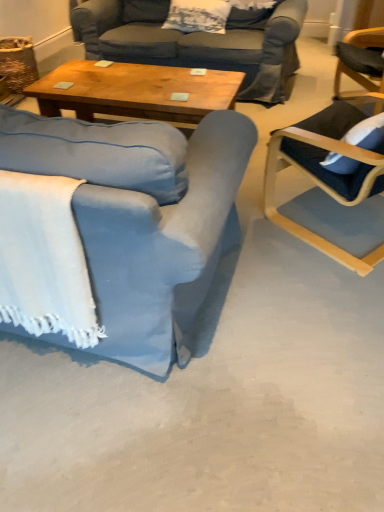
In order to face blue fabric chair at left, marked as the 1th chair in a left-to-right arrangement, should I rotate leftwards or rightwards?

You should rotate left by 18.166 degrees.

In order to face wooden coffee table at center, should I rotate leftwards or rightwards?

Rotate your view left by about 6.820°.

The image size is (384, 512). What do you see at coordinates (198, 16) in the screenshot? I see `white textured pillow at upper center` at bounding box center [198, 16].

The height and width of the screenshot is (512, 384). I want to click on white woven blanket at lower left, so click(x=44, y=260).

Could you tell me if white textured pillow at upper center is turned towards white woven blanket at lower left?

Yes, white textured pillow at upper center is aimed at white woven blanket at lower left.

Between white textured pillow at upper center and white woven blanket at lower left, which one has larger width?

With larger width is white textured pillow at upper center.

Which is less distant, [169,18] or [27,313]?

Positioned in front is point [27,313].

Looking at their sizes, would you say dark blue fabric chair at right, which ranks as the 1th chair in right-to-left order, is wider or thinner than blue fabric chair at left, marked as the 1th chair in a left-to-right arrangement?

Considering their sizes, dark blue fabric chair at right, which ranks as the 1th chair in right-to-left order, looks slimmer than blue fabric chair at left, marked as the 1th chair in a left-to-right arrangement.

Considering the relative positions of dark blue fabric chair at right, which ranks as the 1th chair in right-to-left order, and blue fabric chair at left, marked as the 1th chair in a left-to-right arrangement, in the image provided, is dark blue fabric chair at right, which ranks as the 1th chair in right-to-left order, to the left of blue fabric chair at left, marked as the 1th chair in a left-to-right arrangement, from the viewer's perspective?

Incorrect, dark blue fabric chair at right, which ranks as the 1th chair in right-to-left order, is not on the left side of blue fabric chair at left, marked as the 1th chair in a left-to-right arrangement.

From a real-world perspective, between dark blue fabric chair at right, the 2th chair when ordered from left to right, and blue fabric chair at left, which is the 2th chair from right to left, who is vertically higher?

In real-world perspective, dark blue fabric chair at right, the 2th chair when ordered from left to right, is above.

Can you confirm if dark blue fabric chair at right, the 2th chair when ordered from left to right, is bigger than blue fabric chair at left, which is the 2th chair from right to left?

No.

Consider the image. From their relative heights in the image, would you say white woven blanket at lower left is taller or shorter than dark blue fabric chair at right, which ranks as the 1th chair in right-to-left order?

In the image, white woven blanket at lower left appears to be shorter than dark blue fabric chair at right, which ranks as the 1th chair in right-to-left order.

How far apart are white woven blanket at lower left and dark blue fabric chair at right, the 2th chair when ordered from left to right?

white woven blanket at lower left and dark blue fabric chair at right, the 2th chair when ordered from left to right, are 1.22 meters apart from each other.

Considering the relative positions of white woven blanket at lower left and dark blue fabric chair at right, which ranks as the 1th chair in right-to-left order, in the image provided, is white woven blanket at lower left to the left of dark blue fabric chair at right, which ranks as the 1th chair in right-to-left order, from the viewer's perspective?

Yes.

Is white woven blanket at lower left oriented away from dark blue fabric chair at right, the 2th chair when ordered from left to right?

No, white woven blanket at lower left's orientation is not away from dark blue fabric chair at right, the 2th chair when ordered from left to right.

What's the angular difference between white textured pillow at upper center and dark blue fabric chair at right, which ranks as the 1th chair in right-to-left order,'s facing directions?

There is a 129-degree angle between the facing directions of white textured pillow at upper center and dark blue fabric chair at right, which ranks as the 1th chair in right-to-left order.

From a real-world perspective, which chair is the 1st one underneath the white textured pillow at upper center? Please provide its 2D coordinates.

[(327, 170)]

From a real-world perspective, is white textured pillow at upper center below dark blue fabric chair at right, which ranks as the 1th chair in right-to-left order?

No, from a real-world perspective, white textured pillow at upper center is not under dark blue fabric chair at right, which ranks as the 1th chair in right-to-left order.

Based on the photo, considering the relative positions of white textured pillow at upper center and dark blue fabric chair at right, which ranks as the 1th chair in right-to-left order, in the image provided, is white textured pillow at upper center to the right of dark blue fabric chair at right, which ranks as the 1th chair in right-to-left order, from the viewer's perspective?

Incorrect, white textured pillow at upper center is not on the right side of dark blue fabric chair at right, which ranks as the 1th chair in right-to-left order.

Can you confirm if white woven blanket at lower left is thinner than white textured pillow at upper center?

Indeed, white woven blanket at lower left has a lesser width compared to white textured pillow at upper center.

Who is taller, white woven blanket at lower left or white textured pillow at upper center?

white woven blanket at lower left is taller.

Where is `blanket below the white textured pillow at upper center (from a real-world perspective)`? The width and height of the screenshot is (384, 512). blanket below the white textured pillow at upper center (from a real-world perspective) is located at coordinates (44, 260).

Is white woven blanket at lower left behind white textured pillow at upper center?

No.

Which is more to the left, dark blue fabric chair at right, which ranks as the 1th chair in right-to-left order, or white woven blanket at lower left?

From the viewer's perspective, white woven blanket at lower left appears more on the left side.

From a real-world perspective, which object rests below the other?

white woven blanket at lower left is physically lower.

The image size is (384, 512). Identify the location of blanket in front of the dark blue fabric chair at right, the 2th chair when ordered from left to right. (44, 260).

Are dark blue fabric chair at right, the 2th chair when ordered from left to right, and white woven blanket at lower left located far from each other?

Yes, dark blue fabric chair at right, the 2th chair when ordered from left to right, and white woven blanket at lower left are quite far apart.

Is white woven blanket at lower left to the left of wooden coffee table at center from the viewer's perspective?

Yes, white woven blanket at lower left is to the left of wooden coffee table at center.

From the image's perspective, is white woven blanket at lower left positioned above or below wooden coffee table at center?

From the image's perspective, white woven blanket at lower left appears below wooden coffee table at center.

How many degrees apart are the facing directions of white woven blanket at lower left and wooden coffee table at center?

The facing directions of white woven blanket at lower left and wooden coffee table at center are 179 degrees apart.

From a real-world perspective, relative to wooden coffee table at center, is white woven blanket at lower left vertically above or below?

white woven blanket at lower left is situated higher than wooden coffee table at center in the real world.

Identify the location of blanket in front of the white textured pillow at upper center. This screenshot has width=384, height=512. point(44,260).

I want to click on chair that appears behind the blue fabric chair at left, marked as the 1th chair in a left-to-right arrangement, so click(327, 170).

Based on their spatial positions, is white textured pillow at upper center or dark blue fabric chair at right, the 2th chair when ordered from left to right, closer to blue fabric chair at left, marked as the 1th chair in a left-to-right arrangement?

dark blue fabric chair at right, the 2th chair when ordered from left to right, is closer to blue fabric chair at left, marked as the 1th chair in a left-to-right arrangement.

From the image, which object appears to be nearer to white textured pillow at upper center, dark blue fabric chair at right, which ranks as the 1th chair in right-to-left order, or white woven blanket at lower left?

Based on the image, dark blue fabric chair at right, which ranks as the 1th chair in right-to-left order, appears to be nearer to white textured pillow at upper center.

From the image, which object appears to be farther from wooden coffee table at center, white woven blanket at lower left or dark blue fabric chair at right, which ranks as the 1th chair in right-to-left order?

white woven blanket at lower left is positioned further to the anchor wooden coffee table at center.

Based on their spatial positions, is blue fabric chair at left, marked as the 1th chair in a left-to-right arrangement, or white textured pillow at upper center further from white woven blanket at lower left?

white textured pillow at upper center.

Estimate the real-world distances between objects in this image. Which object is closer to white textured pillow at upper center, blue fabric chair at left, which is the 2th chair from right to left, or white woven blanket at lower left?

blue fabric chair at left, which is the 2th chair from right to left.

Looking at the image, which one is located further to white textured pillow at upper center, white woven blanket at lower left or dark blue fabric chair at right, the 2th chair when ordered from left to right?

white woven blanket at lower left is positioned further to the anchor white textured pillow at upper center.

Looking at this image, based on their spatial positions, is white textured pillow at upper center or white woven blanket at lower left closer to wooden coffee table at center?

Among the two, white textured pillow at upper center is located nearer to wooden coffee table at center.

Which object lies nearer to the anchor point wooden coffee table at center, blue fabric chair at left, marked as the 1th chair in a left-to-right arrangement, or white woven blanket at lower left?

blue fabric chair at left, marked as the 1th chair in a left-to-right arrangement, is closer to wooden coffee table at center.

The height and width of the screenshot is (512, 384). Identify the location of blanket between blue fabric chair at left, marked as the 1th chair in a left-to-right arrangement, and white textured pillow at upper center from front to back. [x=44, y=260].

Where is `coffee table located between blue fabric chair at left, marked as the 1th chair in a left-to-right arrangement, and white textured pillow at upper center in the depth direction`? Image resolution: width=384 pixels, height=512 pixels. coffee table located between blue fabric chair at left, marked as the 1th chair in a left-to-right arrangement, and white textured pillow at upper center in the depth direction is located at coordinates (135, 91).

You are a GUI agent. You are given a task and a screenshot of the screen. Output one action in this format:
    pyautogui.click(x=<x>, y=<y>)
    Task: Click on the coffee table positioned between white woven blanket at lower left and white textured pillow at upper center from near to far
    Image resolution: width=384 pixels, height=512 pixels.
    Given the screenshot: What is the action you would take?
    pyautogui.click(x=135, y=91)

Where is `coffee table located between white woven blanket at lower left and dark blue fabric chair at right, which ranks as the 1th chair in right-to-left order, in the left-right direction`? coffee table located between white woven blanket at lower left and dark blue fabric chair at right, which ranks as the 1th chair in right-to-left order, in the left-right direction is located at coordinates (135, 91).